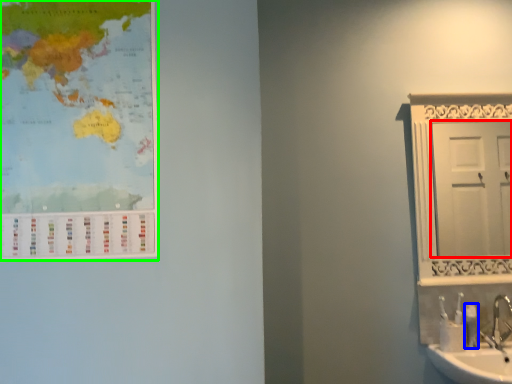
Question: Estimate the real-world distances between objects in this image. Which object is farther from door (highlighted by a red box), toiletry (highlighted by a blue box) or poster (highlighted by a green box)?

Choices:
 (A) toiletry
 (B) poster

Answer: (B)